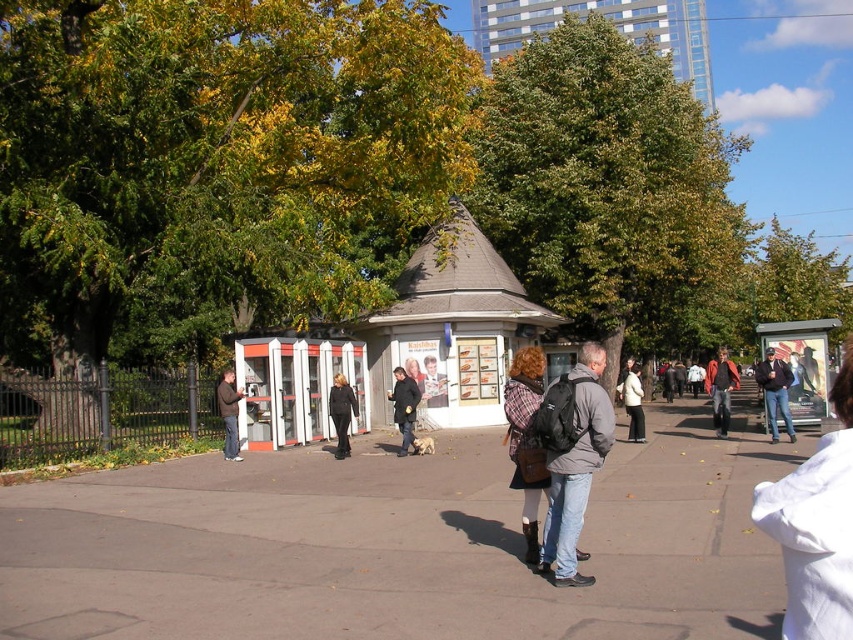
You are a pedestrian wearing a plaid wool coat at center and want to reach the metallic silver bus stop at center right. Are you currently facing the bus stop? Please explain your reasoning.

The metallic silver bus stop at center right is in front of the plaid wool coat at center, which means the plaid wool coat at center is behind the bus stop. Therefore, you are facing the bus stop because it is in front of you.

You are standing at the point marked by the coordinates point (215,164) in the image. What object are you directly facing?

You are directly facing the green leafy tree at upper left.